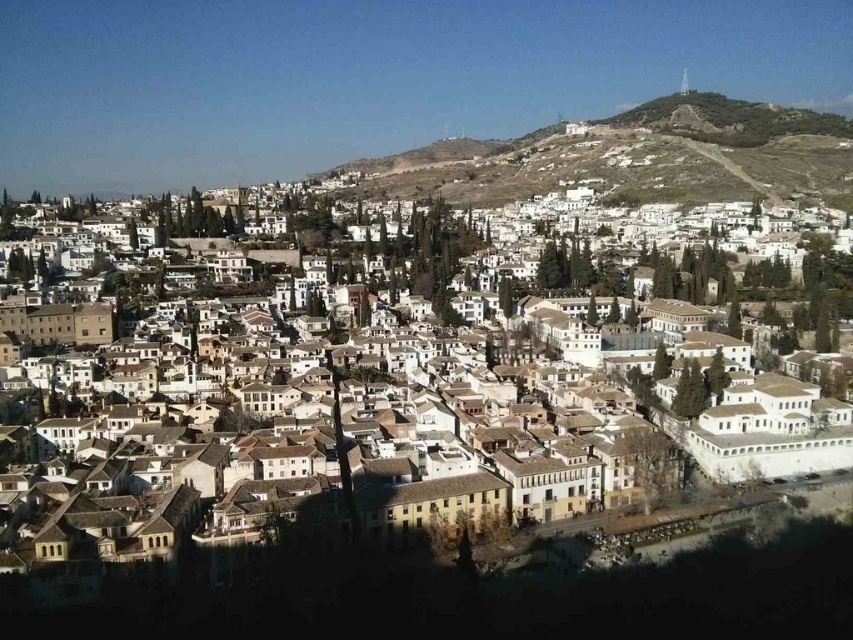
Question: Is white matte buildings at center to the left of earthy brown hillside at upper center from the viewer's perspective?

Choices:
 (A) no
 (B) yes

Answer: (B)

Question: Can you confirm if white matte buildings at center is positioned below earthy brown hillside at upper center?

Choices:
 (A) yes
 (B) no

Answer: (A)

Question: Which of the following is the farthest from the observer?

Choices:
 (A) white matte buildings at center
 (B) earthy brown hillside at upper center

Answer: (B)

Question: Among these points, which one is farthest from the camera?

Choices:
 (A) (125, 380)
 (B) (785, 192)

Answer: (B)

Question: Which of the following is the closest to the observer?

Choices:
 (A) earthy brown hillside at upper center
 (B) white matte buildings at center

Answer: (B)

Question: Is white matte buildings at center positioned behind earthy brown hillside at upper center?

Choices:
 (A) yes
 (B) no

Answer: (B)